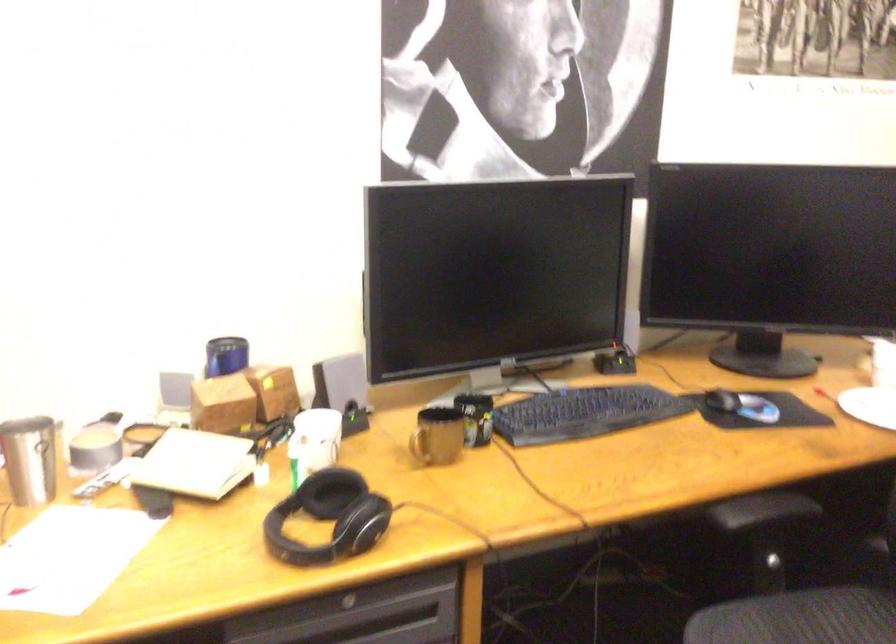
The location [329,518] corresponds to which object?

It refers to a black headphones.